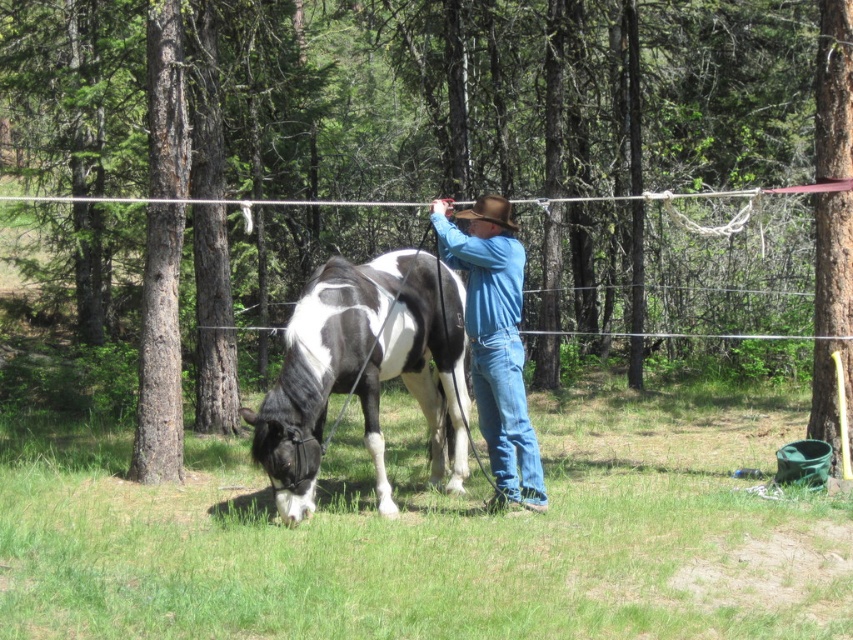
You are a hiker who wants to cross the rope fence. You see a brown rough bark tree at left and a smooth bark tree at right. Which tree is closer to the rope fence?

The brown rough bark tree at left is closer to the rope fence because it is positioned to the left of the smooth bark tree at right, and the fence runs horizontally across the image.

You are a park ranger planning to install a treehouse between the brown rough bark tree at left and the smooth bark tree at right. Which tree should you choose if you want the treehouse to be higher off the ground?

The smooth bark tree at right is taller than the brown rough bark tree at left, so you should choose the smooth bark tree at right to build the treehouse higher off the ground.